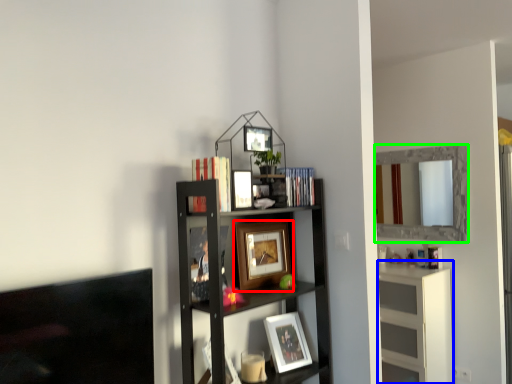
Question: Considering the real-world distances, which object is farthest from picture frame (highlighted by a red box)? cabinet (highlighted by a blue box) or mirror (highlighted by a green box)?

Choices:
 (A) cabinet
 (B) mirror

Answer: (B)